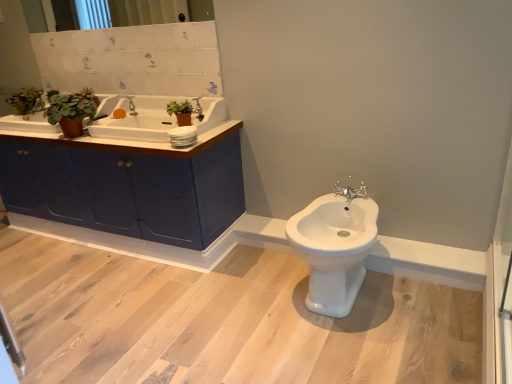
At what (x,y) coordinates should I click in order to perform the action: click on silver metallic tap at upper center, acting as the first tap starting from the back. Please return your answer as a coordinate pair (x, y). The width and height of the screenshot is (512, 384). Looking at the image, I should click on (132, 106).

Measure the distance between white glossy bidet at center and camera.

They are 5.45 feet apart.

The width and height of the screenshot is (512, 384). Describe the element at coordinates (128, 185) in the screenshot. I see `matte blue cabinet at left` at that location.

Where is `clear glass mirror at upper center`? Image resolution: width=512 pixels, height=384 pixels. clear glass mirror at upper center is located at coordinates (64, 15).

What do you see at coordinates (351, 191) in the screenshot? This screenshot has width=512, height=384. I see `silver metallic tap at center, the first tap ordered from the bottom` at bounding box center [351, 191].

This screenshot has width=512, height=384. I want to click on silver metallic tap at upper center, the first tap viewed from the top, so click(x=132, y=106).

Is green matte plant at upper left, the 2th plant positioned from the left, smaller than silver metallic tap at upper center, the first tap viewed from the left?

No, green matte plant at upper left, the 2th plant positioned from the left, is not smaller than silver metallic tap at upper center, the first tap viewed from the left.

Is green matte plant at upper left, positioned as the first plant in right-to-left order, not near silver metallic tap at upper center, the first tap viewed from the top?

That's not correct — green matte plant at upper left, positioned as the first plant in right-to-left order, is a little close to silver metallic tap at upper center, the first tap viewed from the top.

Which of these two, green matte plant at upper left, positioned as the first plant in right-to-left order, or silver metallic tap at upper center, the first tap viewed from the left, stands shorter?

silver metallic tap at upper center, the first tap viewed from the left, is shorter.

Considering the relative positions of silver metallic tap at upper center, the second tap in the bottom-to-top sequence, and white glossy bidet at center in the image provided, is silver metallic tap at upper center, the second tap in the bottom-to-top sequence, to the left or to the right of white glossy bidet at center?

Clearly, silver metallic tap at upper center, the second tap in the bottom-to-top sequence, is on the left of white glossy bidet at center in the image.

Is silver metallic tap at upper center, acting as the first tap starting from the back, in contact with white glossy bidet at center?

No, silver metallic tap at upper center, acting as the first tap starting from the back, is not touching white glossy bidet at center.

Is point (132, 106) closer to camera compared to point (319, 253)?

No, (132, 106) is further to viewer.

Where is `the 2nd tap behind the white glossy bidet at center`? the 2nd tap behind the white glossy bidet at center is located at coordinates (132, 106).

Is point (213, 97) positioned behind point (26, 114)?

No, (213, 97) is closer to viewer.

Considering the positions of objects white ceramic sink at upper left and green matte plant at upper left, the 1th plant from the left, in the image provided, who is in front, white ceramic sink at upper left or green matte plant at upper left, the 1th plant from the left,?

white ceramic sink at upper left.

Is white ceramic sink at upper left oriented away from green matte plant at upper left, the 1th plant from the left?

No.

In the scene shown: How much distance is there between white ceramic sink at upper left and green matte plant at upper left, arranged as the 2th plant when viewed from the right?

97.70 centimeters.

Is green matte plant at upper left, the 1th plant from the left, surrounded by clear glass mirror at upper center?

No, green matte plant at upper left, the 1th plant from the left, is not a part of clear glass mirror at upper center.

Based on the photo, from a real-world perspective, is clear glass mirror at upper center positioned above or below green matte plant at upper left, the 1th plant from the left?

clear glass mirror at upper center is above green matte plant at upper left, the 1th plant from the left.

From the picture: Is clear glass mirror at upper center aimed at green matte plant at upper left, the 1th plant from the left?

No, clear glass mirror at upper center does not turn towards green matte plant at upper left, the 1th plant from the left.

Between clear glass mirror at upper center and green matte plant at upper left, the 1th plant from the left, which one has larger size?

With larger size is green matte plant at upper left, the 1th plant from the left.

From the image's perspective, is clear glass mirror at upper center located beneath green matte plant at upper left, positioned as the first plant in right-to-left order?

No, from the image's perspective, clear glass mirror at upper center is not beneath green matte plant at upper left, positioned as the first plant in right-to-left order.

Is clear glass mirror at upper center in front of or behind green matte plant at upper left, positioned as the first plant in right-to-left order, in the image?

Clearly, clear glass mirror at upper center is in front of green matte plant at upper left, positioned as the first plant in right-to-left order.

Consider the image. Is there a large distance between clear glass mirror at upper center and green matte plant at upper left, positioned as the first plant in right-to-left order?

No, clear glass mirror at upper center is in close proximity to green matte plant at upper left, positioned as the first plant in right-to-left order.

In terms of height, does clear glass mirror at upper center look taller or shorter compared to green matte plant at upper left, the 2th plant positioned from the left?

Clearly, clear glass mirror at upper center is taller compared to green matte plant at upper left, the 2th plant positioned from the left.

Does green matte plant at upper left, the 2th plant positioned from the left, turn towards matte blue cabinet at left?

No, green matte plant at upper left, the 2th plant positioned from the left, is not oriented towards matte blue cabinet at left.

Considering the sizes of objects green matte plant at upper left, positioned as the first plant in right-to-left order, and matte blue cabinet at left in the image provided, who is smaller, green matte plant at upper left, positioned as the first plant in right-to-left order, or matte blue cabinet at left?

green matte plant at upper left, positioned as the first plant in right-to-left order, is smaller.

From a real-world perspective, is green matte plant at upper left, positioned as the first plant in right-to-left order, below matte blue cabinet at left?

Actually, green matte plant at upper left, positioned as the first plant in right-to-left order, is physically above matte blue cabinet at left in the real world.

Considering the sizes of objects green matte plant at upper left, arranged as the 2th plant when viewed from the right, and silver metallic tap at center, acting as the 2th tap starting from the top, in the image provided, who is wider, green matte plant at upper left, arranged as the 2th plant when viewed from the right, or silver metallic tap at center, acting as the 2th tap starting from the top,?

green matte plant at upper left, arranged as the 2th plant when viewed from the right.

Which is in front, point (38, 94) or point (337, 185)?

The point (337, 185) is in front.

Based on the photo, is green matte plant at upper left, the 1th plant from the left, directly adjacent to silver metallic tap at center, the second tap from the back?

No, green matte plant at upper left, the 1th plant from the left, is not making contact with silver metallic tap at center, the second tap from the back.

Is green matte plant at upper left, the 1th plant from the left, facing towards silver metallic tap at center, the first tap ordered from the bottom?

No, green matte plant at upper left, the 1th plant from the left, is not oriented towards silver metallic tap at center, the first tap ordered from the bottom.

Where is `the 1st plant positioned above the silver metallic tap at upper center, the first tap viewed from the left (from a real-world perspective)`? the 1st plant positioned above the silver metallic tap at upper center, the first tap viewed from the left (from a real-world perspective) is located at coordinates (87, 95).

This screenshot has width=512, height=384. In order to click on toilet in front of the silver metallic tap at upper center, the second tap in the bottom-to-top sequence in this screenshot , I will do `click(335, 246)`.

Estimate the real-world distances between objects in this image. Which object is further from silver metallic tap at upper center, acting as the first tap starting from the back, silver metallic tap at center, the second tap from the back, or matte blue cabinet at left?

Among the two, silver metallic tap at center, the second tap from the back, is located further to silver metallic tap at upper center, acting as the first tap starting from the back.

Based on their spatial positions, is clear glass mirror at upper center or silver metallic tap at upper center, positioned as the 2th tap in front-to-back order, further from silver metallic tap at center, placed as the first tap when sorted from front to back?

The object further to silver metallic tap at center, placed as the first tap when sorted from front to back, is clear glass mirror at upper center.

Based on their spatial positions, is green matte plant at upper left, the 2th plant positioned from the left, or matte blue cabinet at left further from silver metallic tap at upper center, the first tap viewed from the left?

matte blue cabinet at left.

From the image, which object appears to be farther from white glossy bidet at center, matte blue cabinet at left or green matte plant at upper left, arranged as the 2th plant when viewed from the right?

Among the two, green matte plant at upper left, arranged as the 2th plant when viewed from the right, is located further to white glossy bidet at center.

When comparing their distances from matte blue cabinet at left, does silver metallic tap at upper center, the second tap in the bottom-to-top sequence, or clear glass mirror at upper center seem further?

Based on the image, clear glass mirror at upper center appears to be further to matte blue cabinet at left.

Based on their spatial positions, is matte blue cabinet at left or white glossy bidet at center closer to silver metallic tap at upper center, acting as the first tap starting from the back?

matte blue cabinet at left.

When comparing their distances from silver metallic tap at center, placed as the first tap when sorted from front to back, does silver metallic tap at upper center, the first tap viewed from the left, or matte blue cabinet at left seem closer?

Among the two, matte blue cabinet at left is located nearer to silver metallic tap at center, placed as the first tap when sorted from front to back.

Based on their spatial positions, is green matte plant at upper left, the 2th plant positioned from the left, or clear glass mirror at upper center closer to green matte plant at upper left, the 1th plant from the left?

The object closer to green matte plant at upper left, the 1th plant from the left, is green matte plant at upper left, the 2th plant positioned from the left.

Locate an element on the screen. The image size is (512, 384). mirror between green matte plant at upper left, arranged as the 2th plant when viewed from the right, and white ceramic sink at upper left, in the horizontal direction is located at coordinates (64, 15).

Identify the location of sink that lies between clear glass mirror at upper center and matte blue cabinet at left from top to bottom. (139, 121).

The height and width of the screenshot is (384, 512). In order to click on sink located between matte blue cabinet at left and green matte plant at upper left, positioned as the first plant in right-to-left order, in the depth direction in this screenshot , I will do `click(139, 121)`.

What are the coordinates of `sink positioned between matte blue cabinet at left and silver metallic tap at upper center, the first tap viewed from the left, from near to far` in the screenshot? It's located at (139, 121).